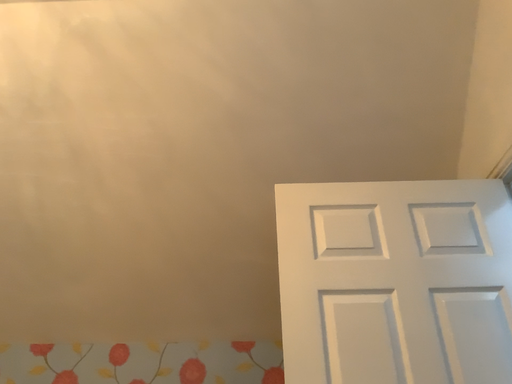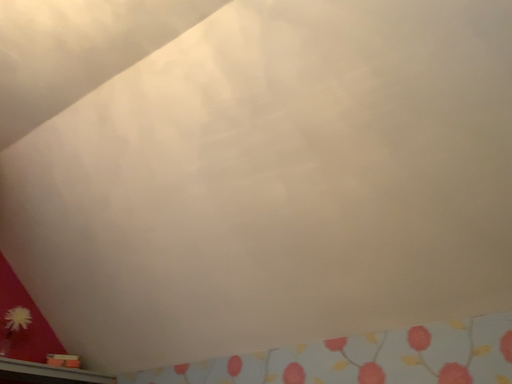
Question: Which way did the camera rotate in the video?

Choices:
 (A) rotated right
 (B) rotated left

Answer: (B)